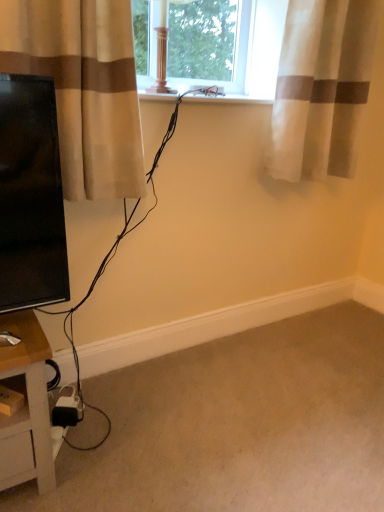
Where is `beige carpet at lower right`? beige carpet at lower right is located at coordinates [238, 425].

Describe the element at coordinates (83, 88) in the screenshot. I see `beige fabric curtain at left, the second curtain in the right-to-left sequence` at that location.

Where is `beige carpet at lower right`? This screenshot has height=512, width=384. beige carpet at lower right is located at coordinates (238, 425).

Considering the relative positions of beige fabric curtain at left, which is the first curtain in left-to-right order, and sheer fabric curtain at upper right, the second curtain in the front-to-back sequence, in the image provided, is beige fabric curtain at left, which is the first curtain in left-to-right order, in front of sheer fabric curtain at upper right, the second curtain in the front-to-back sequence,?

That is True.

Is sheer fabric curtain at upper right, the second curtain in the front-to-back sequence, at the back of beige fabric curtain at left, which is the 1th curtain from front to back?

That's not correct — beige fabric curtain at left, which is the 1th curtain from front to back, is not looking away from sheer fabric curtain at upper right, the second curtain in the front-to-back sequence.

Is beige fabric curtain at left, the second curtain in the right-to-left sequence, placed right next to sheer fabric curtain at upper right, arranged as the 1th curtain when viewed from the back?

beige fabric curtain at left, the second curtain in the right-to-left sequence, is not next to sheer fabric curtain at upper right, arranged as the 1th curtain when viewed from the back, and they're not touching.

Is beige fabric curtain at left, which is the first curtain in left-to-right order, bigger or smaller than sheer fabric curtain at upper right, positioned as the 1th curtain in right-to-left order?

Clearly, beige fabric curtain at left, which is the first curtain in left-to-right order, is smaller in size than sheer fabric curtain at upper right, positioned as the 1th curtain in right-to-left order.

Can we say sheer fabric curtain at upper right, positioned as the 1th curtain in right-to-left order, lies outside beige fabric curtain at left, the second curtain when ordered from back to front?

Absolutely, sheer fabric curtain at upper right, positioned as the 1th curtain in right-to-left order, is external to beige fabric curtain at left, the second curtain when ordered from back to front.

Is the position of sheer fabric curtain at upper right, the second curtain in the front-to-back sequence, more distant than that of beige fabric curtain at left, the second curtain when ordered from back to front?

That is True.

How many degrees apart are the facing directions of sheer fabric curtain at upper right, positioned as the 1th curtain in right-to-left order, and beige fabric curtain at left, which is the first curtain in left-to-right order?

0.00637 degrees separate the facing orientations of sheer fabric curtain at upper right, positioned as the 1th curtain in right-to-left order, and beige fabric curtain at left, which is the first curtain in left-to-right order.

Can you confirm if beige carpet at lower right is thinner than beige fabric curtain at left, the second curtain when ordered from back to front?

No.

How many degrees apart are the facing directions of beige carpet at lower right and beige fabric curtain at left, the second curtain when ordered from back to front?

They differ by 179 degrees in their facing directions.

Is beige carpet at lower right looking in the opposite direction of beige fabric curtain at left, which is the first curtain in left-to-right order?

No.

Is beige carpet at lower right not near beige fabric curtain at left, which is the first curtain in left-to-right order?

That's not correct — beige carpet at lower right is a little close to beige fabric curtain at left, which is the first curtain in left-to-right order.

Does sheer fabric curtain at upper right, arranged as the 1th curtain when viewed from the back, turn towards beige carpet at lower right?

No, sheer fabric curtain at upper right, arranged as the 1th curtain when viewed from the back, is not aimed at beige carpet at lower right.

Is point (315, 89) closer or farther from the camera than point (101, 502)?

Clearly, point (315, 89) is more distant from the camera than point (101, 502).

Between sheer fabric curtain at upper right, placed as the 2th curtain when sorted from left to right, and beige carpet at lower right, which one appears on the left side from the viewer's perspective?

beige carpet at lower right.

In the scene shown: Which of these two, beige fabric curtain at left, the second curtain in the right-to-left sequence, or beige carpet at lower right, stands taller?

Standing taller between the two is beige fabric curtain at left, the second curtain in the right-to-left sequence.

Consider the image. Is beige fabric curtain at left, the second curtain in the right-to-left sequence, to the right of beige carpet at lower right from the viewer's perspective?

Incorrect, beige fabric curtain at left, the second curtain in the right-to-left sequence, is not on the right side of beige carpet at lower right.

The image size is (384, 512). What are the coordinates of `curtain that appears on the left of beige carpet at lower right` in the screenshot? It's located at (83, 88).

From the picture: Is beige fabric curtain at left, the second curtain when ordered from back to front, directly adjacent to beige carpet at lower right?

beige fabric curtain at left, the second curtain when ordered from back to front, and beige carpet at lower right are not in contact.

Between beige carpet at lower right and sheer fabric curtain at upper right, positioned as the 1th curtain in right-to-left order, which one has larger size?

With larger size is beige carpet at lower right.

Does beige carpet at lower right turn towards sheer fabric curtain at upper right, the second curtain in the front-to-back sequence?

No.

Between beige carpet at lower right and sheer fabric curtain at upper right, positioned as the 1th curtain in right-to-left order, which one has more height?

sheer fabric curtain at upper right, positioned as the 1th curtain in right-to-left order, is taller.

Consider the image. From a real-world perspective, is beige carpet at lower right located beneath sheer fabric curtain at upper right, placed as the 2th curtain when sorted from left to right?

Correct, in the physical world, beige carpet at lower right is lower than sheer fabric curtain at upper right, placed as the 2th curtain when sorted from left to right.

At what (x,y) coordinates should I click in order to perform the action: click on curtain on the right of beige fabric curtain at left, the second curtain when ordered from back to front. Please return your answer as a coordinate pair (x, y). Image resolution: width=384 pixels, height=512 pixels. Looking at the image, I should click on (322, 87).

Locate an element on the screen. The height and width of the screenshot is (512, 384). curtain behind the beige fabric curtain at left, which is the first curtain in left-to-right order is located at coordinates (322, 87).

Estimate the real-world distances between objects in this image. Which object is closer to sheer fabric curtain at upper right, arranged as the 1th curtain when viewed from the back, beige carpet at lower right or beige fabric curtain at left, which is the first curtain in left-to-right order?

beige fabric curtain at left, which is the first curtain in left-to-right order, lies closer to sheer fabric curtain at upper right, arranged as the 1th curtain when viewed from the back, than the other object.

In the scene shown: Considering their positions, is sheer fabric curtain at upper right, positioned as the 1th curtain in right-to-left order, positioned closer to beige fabric curtain at left, the second curtain when ordered from back to front, than beige carpet at lower right?

sheer fabric curtain at upper right, positioned as the 1th curtain in right-to-left order, is closer to beige fabric curtain at left, the second curtain when ordered from back to front.

Which object lies nearer to the anchor point beige fabric curtain at left, the second curtain in the right-to-left sequence, beige carpet at lower right or sheer fabric curtain at upper right, placed as the 2th curtain when sorted from left to right?

sheer fabric curtain at upper right, placed as the 2th curtain when sorted from left to right, lies closer to beige fabric curtain at left, the second curtain in the right-to-left sequence, than the other object.

Considering their positions, is sheer fabric curtain at upper right, placed as the 2th curtain when sorted from left to right, positioned closer to beige carpet at lower right than beige fabric curtain at left, which is the 1th curtain from front to back?

The object closer to beige carpet at lower right is beige fabric curtain at left, which is the 1th curtain from front to back.

Based on their spatial positions, is beige fabric curtain at left, which is the 1th curtain from front to back, or sheer fabric curtain at upper right, positioned as the 1th curtain in right-to-left order, further from beige carpet at lower right?

sheer fabric curtain at upper right, positioned as the 1th curtain in right-to-left order, lies further to beige carpet at lower right than the other object.

Which object lies further to the anchor point sheer fabric curtain at upper right, arranged as the 1th curtain when viewed from the back, beige fabric curtain at left, the second curtain in the right-to-left sequence, or beige carpet at lower right?

beige carpet at lower right is positioned further to the anchor sheer fabric curtain at upper right, arranged as the 1th curtain when viewed from the back.

This screenshot has width=384, height=512. In order to click on curtain between sheer fabric curtain at upper right, placed as the 2th curtain when sorted from left to right, and beige carpet at lower right, in the vertical direction in this screenshot , I will do `click(83, 88)`.